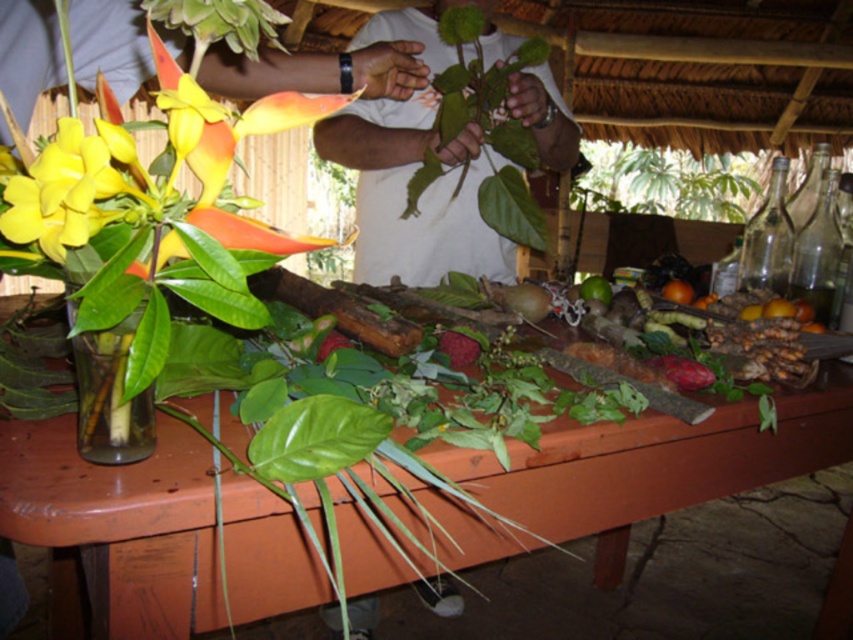
You are setting up a small display at the market stall. You have a green leafy plant at upper center and a green matte lime at center. Which object should you place on the lower shelf if you want to ensure that the taller item is placed on the higher shelf?

The green leafy plant at upper center is taller than the green matte lime at center, so you should place the green leafy plant at upper center on the higher shelf and the green matte lime at center on the lower shelf.

Looking at this image, you are setting up a display for a rustic market stall. You have a matte glass vase at left and an orange matte at center. Based on the scene, where should you place a decorative item that needs to be visible from above? Explain your reasoning.

The matte glass vase at left is above the orange matte at center, so placing the decorative item on top of the matte glass vase at left would make it more visible from above.

You are a customer at this rustic market stall. You want to place a small basket on the wooden table at center without blocking the yellow matte flower at upper left. Where should you place the basket?

You should place the basket on the right side of the wooden table at center since the wooden table at center is positioned on the right side of the yellow matte flower at upper left, leaving space to the right of the table to place the basket without blocking the flower.